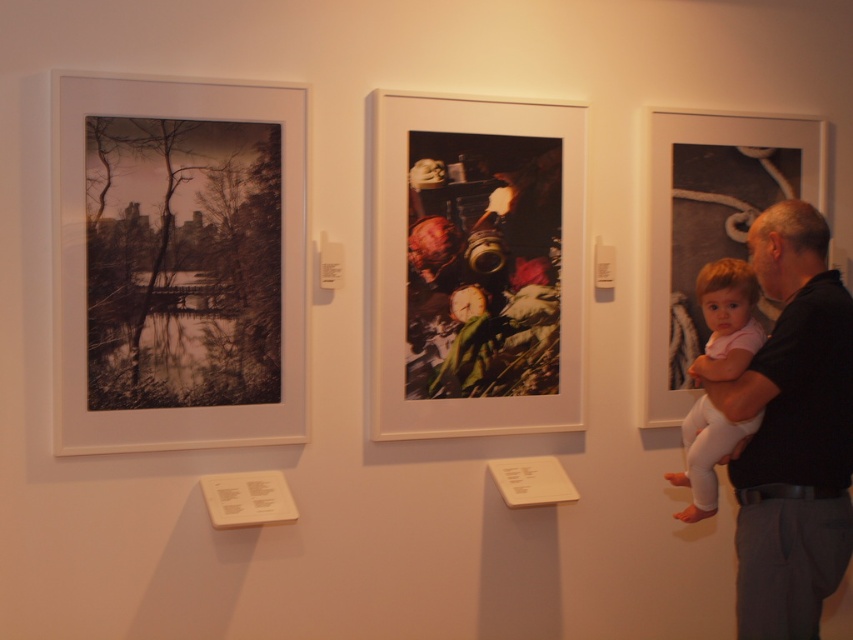
You are standing in front of the middle frame in the art gallery. There are two points marked in this frame, one at coordinates point [848,428] and another at point [682,236]. From your perspective, which point is closer to you?

Point [848,428] is in front of point [682,236], so it is closer to you.

You are an interior designer planning to hang a new painting in this gallery. You want to place it below the existing matte black frame at right but above the light pink fabric baby at right. Is there enough vertical space between them to accommodate a standard 12 inch tall painting?

The matte black frame at right is located above the light pink fabric baby at right. Since the vertical space between them must be at least 12 inches to fit the painting, but the exact distance isn t provided, it s uncertain. However, since the question states the frame is above the baby, there is some space. Without specific measurements, we can assume it might be possible if the gap is sufficient. But strictly based on given info, we can only confirm the positional relationship, not the exact space. So, I